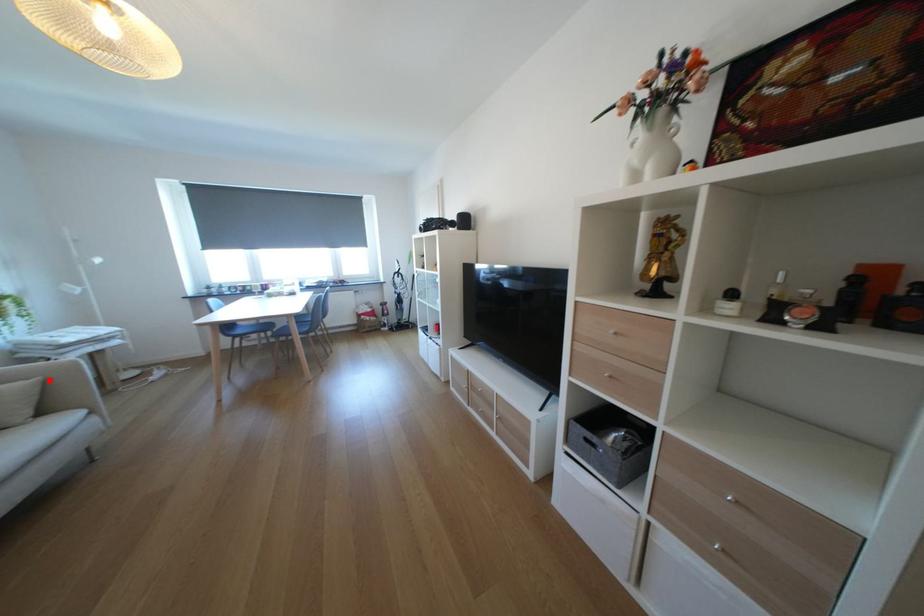
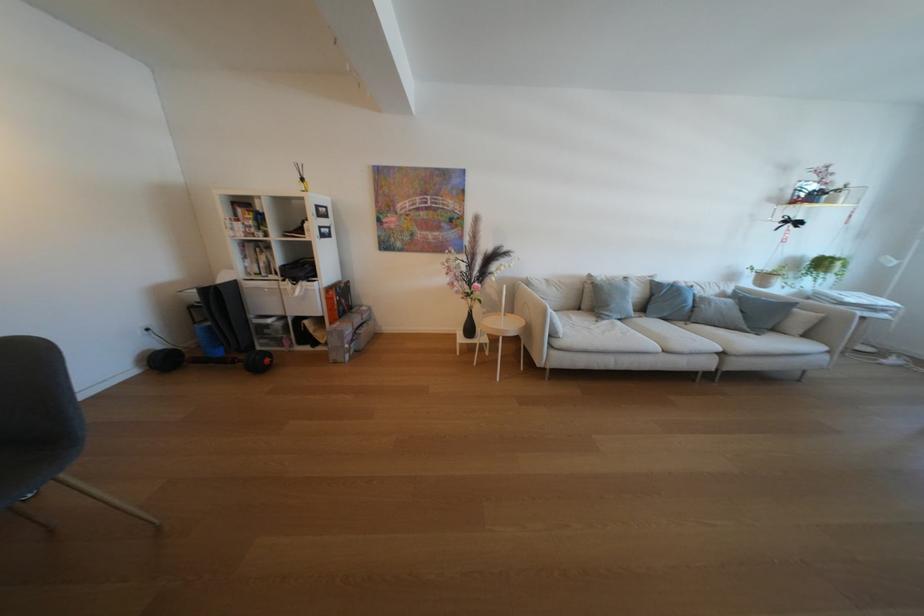
Question: I am providing you with two images of the same scene from different viewpoints. In image1, a red point is highlighted. Considering the same 3D point in image2, which of the following is correct?

Choices:
 (A) It is closer
 (B) It is farther

Answer: (A)